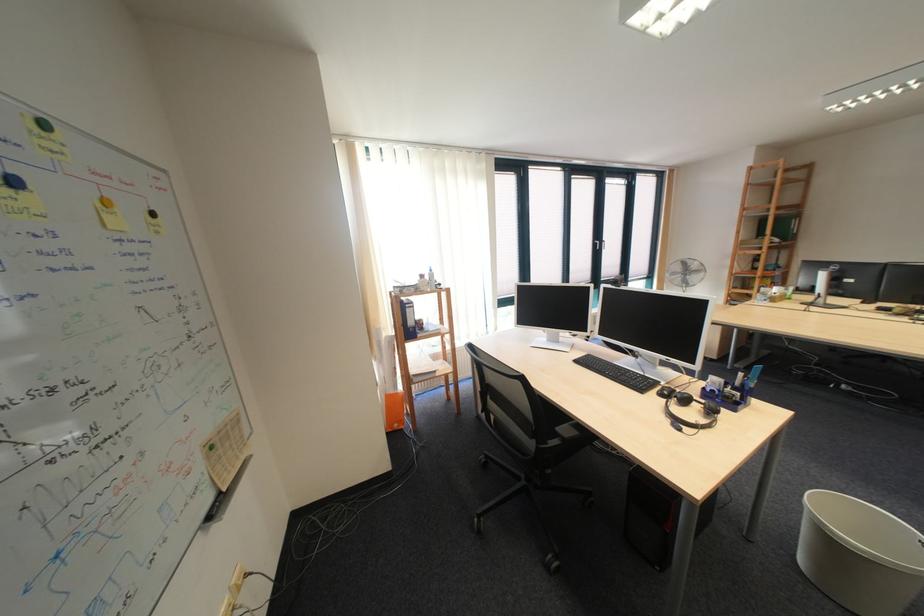
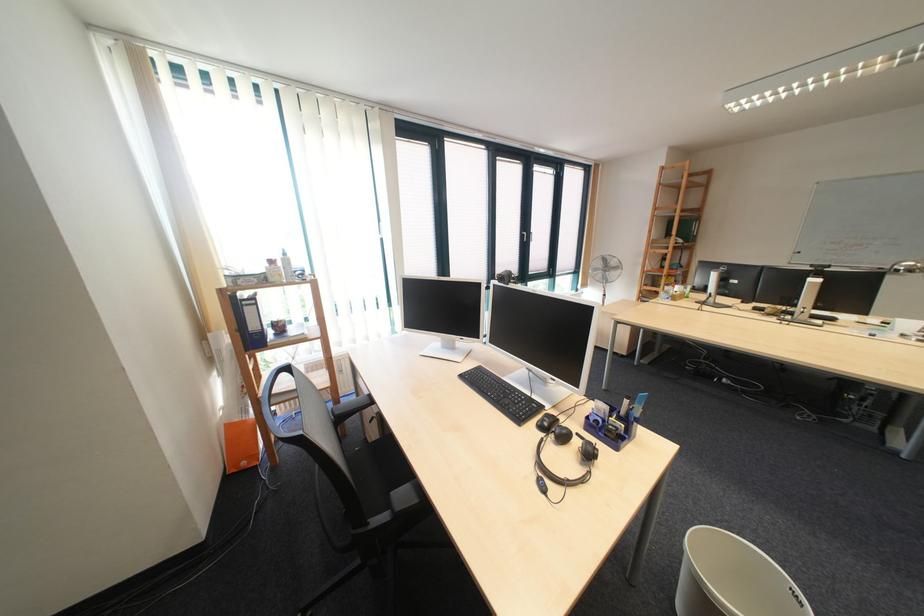
Where in the second image is the point corresponding to (612,249) from the first image?

(540, 241)